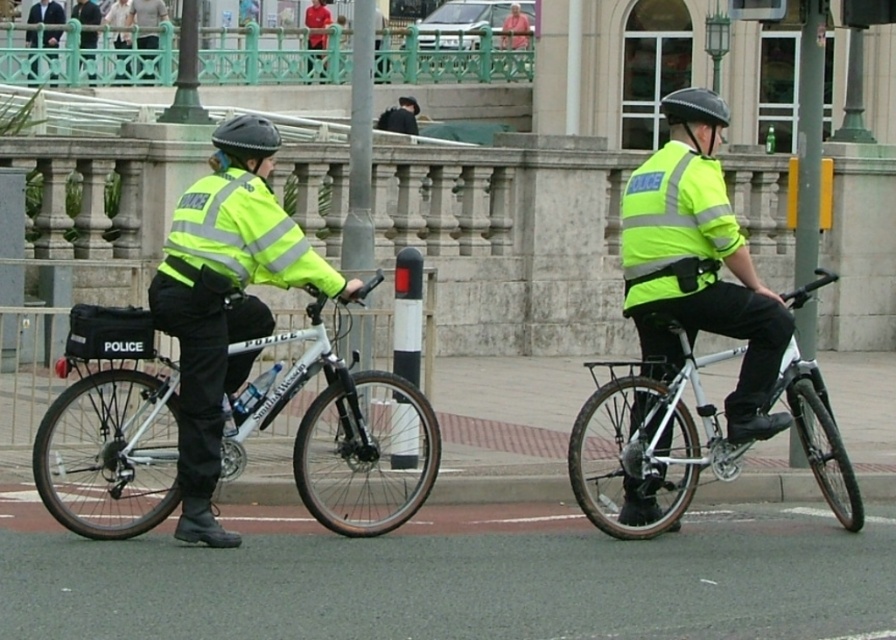
Who is more forward, (113,67) or (218,147)?

Point (218,147)

This screenshot has width=896, height=640. Find the location of `green textured railing at upper center`. green textured railing at upper center is located at coordinates click(97, 44).

Locate an element on the screen. The height and width of the screenshot is (640, 896). green textured railing at upper center is located at coordinates (97, 44).

Who is lower down, high visibility yellow reflective vest at center or matte black helmet at left?

high visibility yellow reflective vest at center is lower down.

Does high visibility yellow reflective vest at center lie in front of matte black helmet at left?

No, it is behind matte black helmet at left.

The image size is (896, 640). In order to click on high visibility yellow reflective vest at center in this screenshot , I will do `click(698, 262)`.

Is high visibility reflective jacket at center wider than silver metallic bicycle at center?

Correct, the width of high visibility reflective jacket at center exceeds that of silver metallic bicycle at center.

Which is in front, point (184, 424) or point (567, 451)?

Point (184, 424) is more forward.

Image resolution: width=896 pixels, height=640 pixels. I want to click on high visibility reflective jacket at center, so click(x=224, y=310).

This screenshot has width=896, height=640. Find the location of `high visibility reflective jacket at center`. high visibility reflective jacket at center is located at coordinates (x=224, y=310).